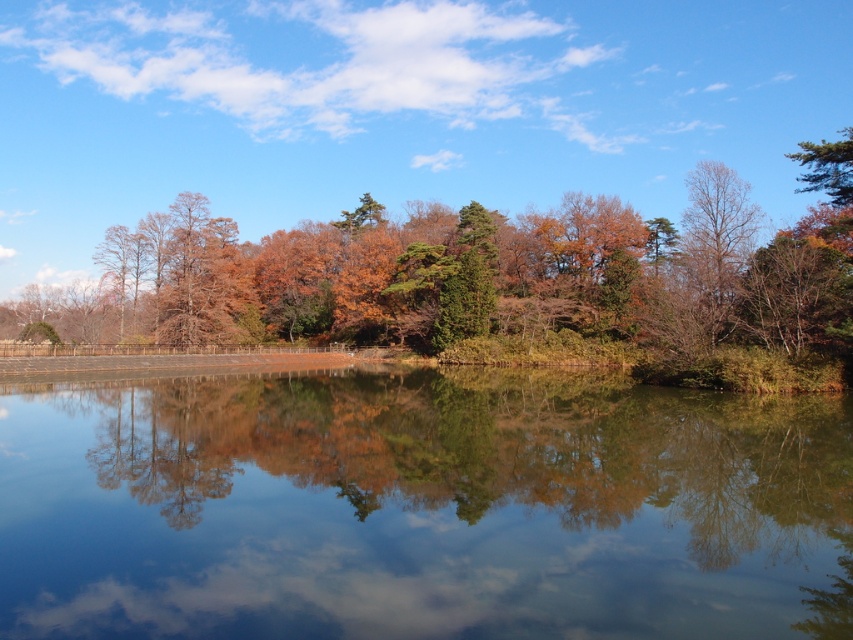
Is green reflective water at center positioned at the back of green matte tree at center?

No, it is not.

Between point (131, 413) and point (390, 304), which one is positioned in front?

Positioned in front is point (131, 413).

Locate an element on the screen. The width and height of the screenshot is (853, 640). green reflective water at center is located at coordinates (422, 508).

Is green reflective water at center wider than brown matte tree at upper left?

Correct, the width of green reflective water at center exceeds that of brown matte tree at upper left.

What do you see at coordinates (422, 508) in the screenshot?
I see `green reflective water at center` at bounding box center [422, 508].

Where is `green reflective water at center`? Image resolution: width=853 pixels, height=640 pixels. green reflective water at center is located at coordinates (422, 508).

Is green matte tree at center positioned before brown matte tree at upper left?

That is True.

Does green matte tree at center have a lesser width compared to brown matte tree at upper left?

No, green matte tree at center is not thinner than brown matte tree at upper left.

Where is `green matte tree at center`? The image size is (853, 640). green matte tree at center is located at coordinates (482, 275).